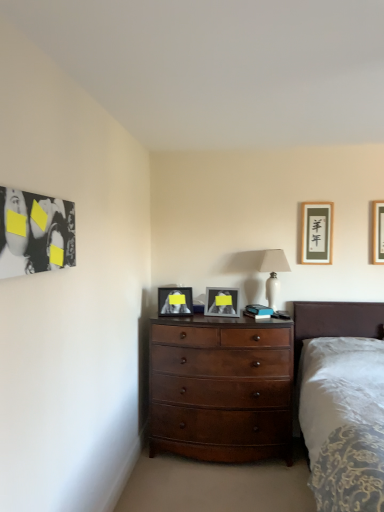
Question: In terms of size, does white ceramic lamp at upper center appear bigger or smaller than mahogany wood dresser at center?

Choices:
 (A) small
 (B) big

Answer: (A)

Question: Is white ceramic lamp at upper center spatially inside mahogany wood dresser at center, or outside of it?

Choices:
 (A) outside
 (B) inside

Answer: (A)

Question: Which is farther from the mahogany wood dresser at center?

Choices:
 (A) wooden picture frame at upper right, the fourth picture frame in the left-to-right sequence
 (B) white ceramic lamp at upper center
 (C) white soft bed at right
 (D) matte black picture frame at center, which is the fourth picture frame in right-to-left order
 (E) matte gray picture frame at center, the 3th picture frame positioned from the right

Answer: (A)

Question: Considering the real-world distances, which object is closest to the matte black picture frame at center, which is the fourth picture frame in right-to-left order?

Choices:
 (A) matte black picture frame at upper right, the 3th picture frame when ordered from left to right
 (B) wooden picture frame at upper right, marked as the 1th picture frame in a right-to-left arrangement
 (C) white soft bed at right
 (D) matte gray picture frame at center, the 3th picture frame positioned from the right
 (E) white ceramic lamp at upper center

Answer: (D)